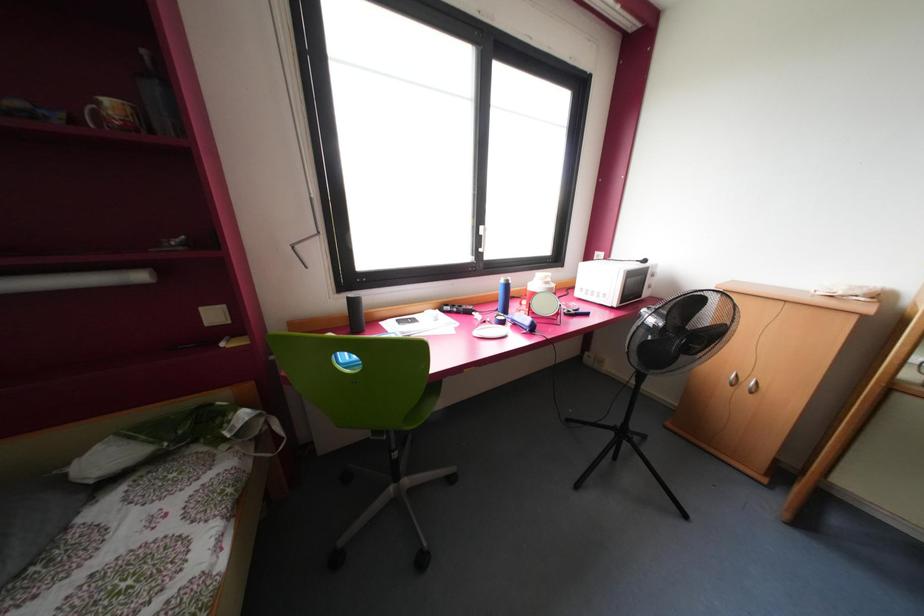
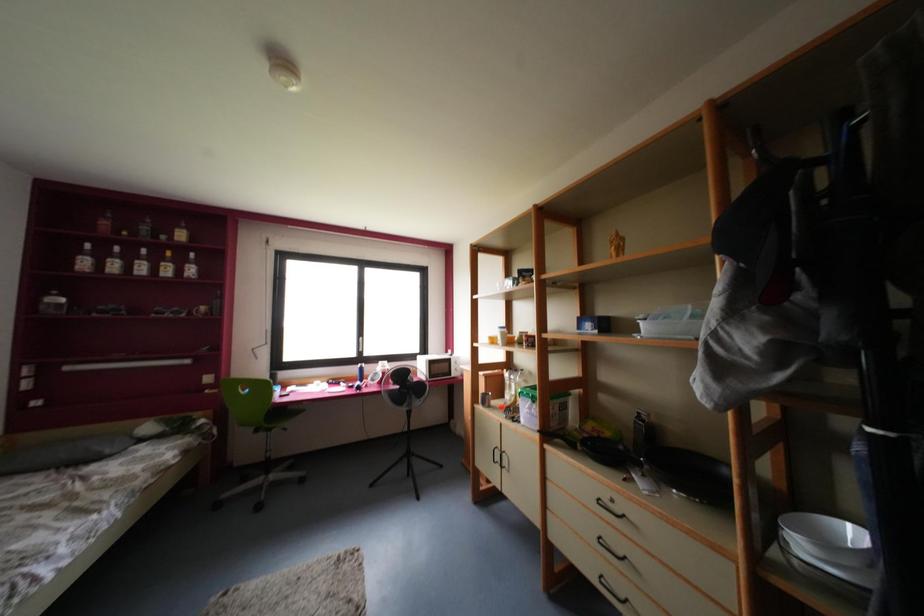
Which direction would the cameraman need to move to produce the second image?

The movement direction of the cameraman is right, backward.